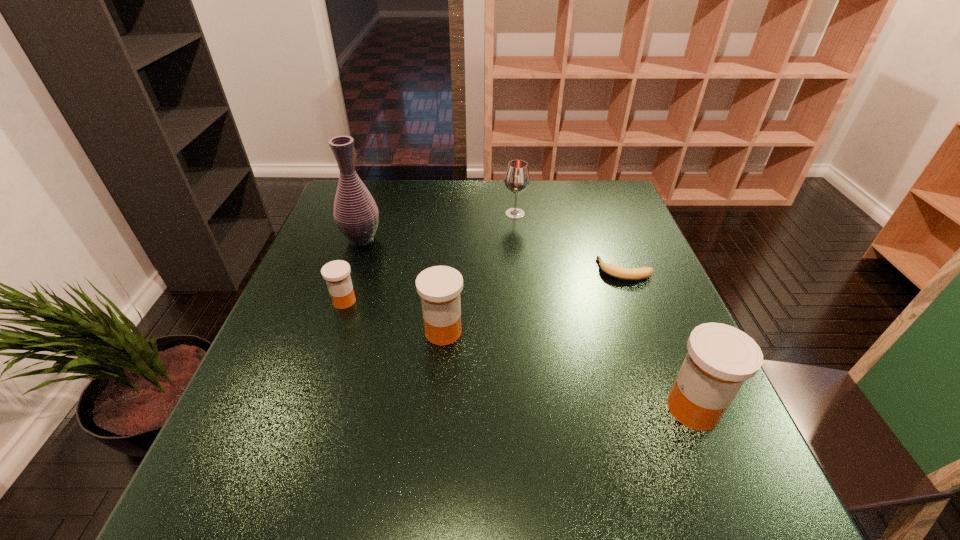
Find the location of a particular element. object that ranks as the fifth closest to the fourth farthest object is located at coordinates (720, 358).

At what (x,y) coordinates should I click in order to perform the action: click on medicine that is the nearest to the wineglass. Please return your answer as a coordinate pair (x, y). Looking at the image, I should click on (439, 287).

The image size is (960, 540). In order to click on the closest medicine to the nearest object in this screenshot , I will do `click(439, 287)`.

You are a GUI agent. You are given a task and a screenshot of the screen. Output one action in this format:
    pyautogui.click(x=<x>, y=<y>)
    Task: Click on the free space that satisfies the following two spatial constraints: 1. on the front side of the wineglass; 2. on the label of the farthest medicine
    The height and width of the screenshot is (540, 960).
    Given the screenshot: What is the action you would take?
    pyautogui.click(x=524, y=301)

Locate an element on the screen. The width and height of the screenshot is (960, 540). free spot that satisfies the following two spatial constraints: 1. on the front side of the shortest object; 2. on the left side of the second farthest object is located at coordinates (350, 271).

In order to click on vacant point that satisfies the following two spatial constraints: 1. on the front side of the tallest object; 2. on the left side of the shortest object in this screenshot , I will do pos(350,271).